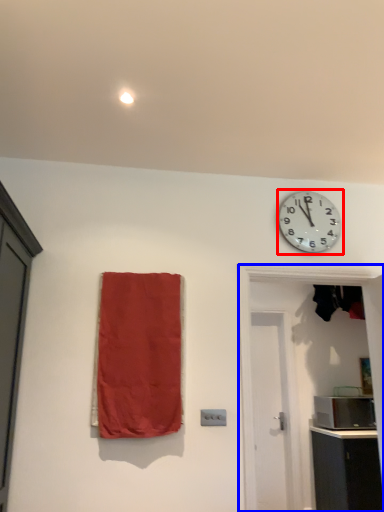
Question: Which point is closer to the camera, wall clock (highlighted by a red box) or door (highlighted by a blue box)?

Choices:
 (A) wall clock
 (B) door

Answer: (B)